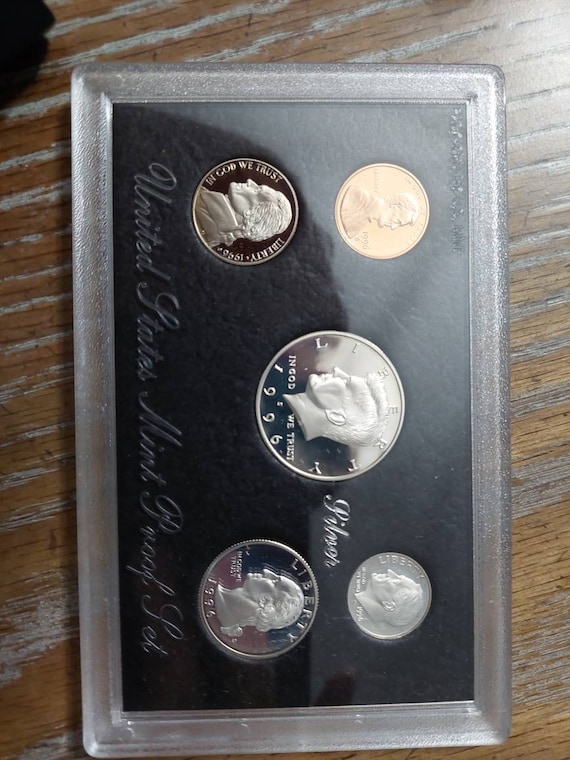
Locate an element on the screen. Image resolution: width=570 pixels, height=760 pixels. empty space on table is located at coordinates (55, 282).